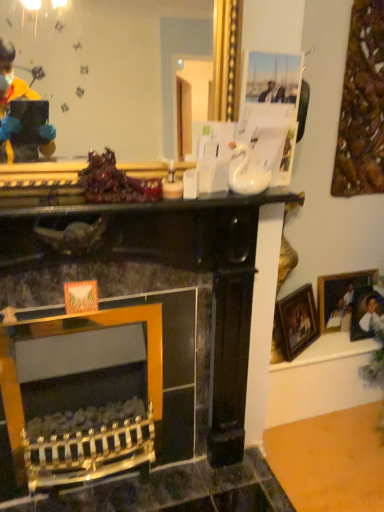
Question: From the image's perspective, does shiny purple grapes at center appear higher than gold metallic mirror at upper center?

Choices:
 (A) no
 (B) yes

Answer: (A)

Question: Does shiny purple grapes at center appear on the left side of gold metallic mirror at upper center?

Choices:
 (A) yes
 (B) no

Answer: (A)

Question: Is shiny purple grapes at center shorter than gold metallic mirror at upper center?

Choices:
 (A) yes
 (B) no

Answer: (A)

Question: From the image's perspective, is shiny purple grapes at center located beneath gold metallic mirror at upper center?

Choices:
 (A) no
 (B) yes

Answer: (B)

Question: Is shiny purple grapes at center facing towards gold metallic mirror at upper center?

Choices:
 (A) yes
 (B) no

Answer: (B)

Question: Is shiny purple grapes at center bigger than gold metallic mirror at upper center?

Choices:
 (A) no
 (B) yes

Answer: (A)

Question: Does gold-framed picture at right, which is the second picture frame from right to left, lie in front of shiny purple grapes at center?

Choices:
 (A) no
 (B) yes

Answer: (A)

Question: From the image's perspective, would you say gold-framed picture at right, the first picture frame when ordered from left to right, is positioned over shiny purple grapes at center?

Choices:
 (A) no
 (B) yes

Answer: (A)

Question: Does gold-framed picture at right, the first picture frame when ordered from left to right, have a larger size compared to shiny purple grapes at center?

Choices:
 (A) no
 (B) yes

Answer: (B)

Question: Is gold-framed picture at right, which is the second picture frame from right to left, to the right of shiny purple grapes at center from the viewer's perspective?

Choices:
 (A) no
 (B) yes

Answer: (B)

Question: Can shiny purple grapes at center be found inside gold-framed picture at right, which is the second picture frame from right to left?

Choices:
 (A) yes
 (B) no

Answer: (B)

Question: Considering the relative sizes of gold-framed picture at right, which is the second picture frame from right to left, and shiny purple grapes at center in the image provided, is gold-framed picture at right, which is the second picture frame from right to left, shorter than shiny purple grapes at center?

Choices:
 (A) yes
 (B) no

Answer: (B)

Question: Is gold metallic mirror at upper center shorter than gold-framed picture at right, which is the second picture frame from right to left?

Choices:
 (A) yes
 (B) no

Answer: (B)